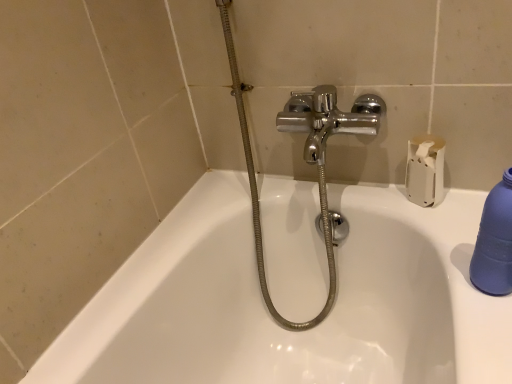
Question: From the image's perspective, is blue matte bottle at right below white matte toilet paper at upper right?

Choices:
 (A) yes
 (B) no

Answer: (A)

Question: From the image's perspective, is blue matte bottle at right above white matte toilet paper at upper right?

Choices:
 (A) yes
 (B) no

Answer: (B)

Question: Is blue matte bottle at right outside of white matte toilet paper at upper right?

Choices:
 (A) yes
 (B) no

Answer: (A)

Question: Is blue matte bottle at right oriented away from white matte toilet paper at upper right?

Choices:
 (A) no
 (B) yes

Answer: (A)

Question: Does blue matte bottle at right appear on the left side of white matte toilet paper at upper right?

Choices:
 (A) no
 (B) yes

Answer: (A)

Question: Is blue matte bottle at right positioned before white matte toilet paper at upper right?

Choices:
 (A) yes
 (B) no

Answer: (A)

Question: From a real-world perspective, is chrome metallic shower at center located higher than white matte toilet paper at upper right?

Choices:
 (A) yes
 (B) no

Answer: (B)

Question: Is chrome metallic shower at center at the left side of white matte toilet paper at upper right?

Choices:
 (A) no
 (B) yes

Answer: (B)

Question: Does chrome metallic shower at center have a lesser height compared to white matte toilet paper at upper right?

Choices:
 (A) no
 (B) yes

Answer: (A)

Question: Can you see chrome metallic shower at center touching white matte toilet paper at upper right?

Choices:
 (A) no
 (B) yes

Answer: (A)

Question: Is white matte toilet paper at upper right completely or partially inside chrome metallic shower at center?

Choices:
 (A) yes
 (B) no

Answer: (B)

Question: Is chrome metallic shower at center positioned with its back to white matte toilet paper at upper right?

Choices:
 (A) yes
 (B) no

Answer: (B)

Question: Does white matte toilet paper at upper right have a smaller size compared to blue matte bottle at right?

Choices:
 (A) no
 (B) yes

Answer: (A)